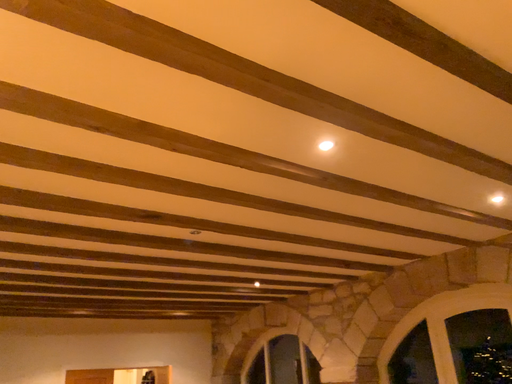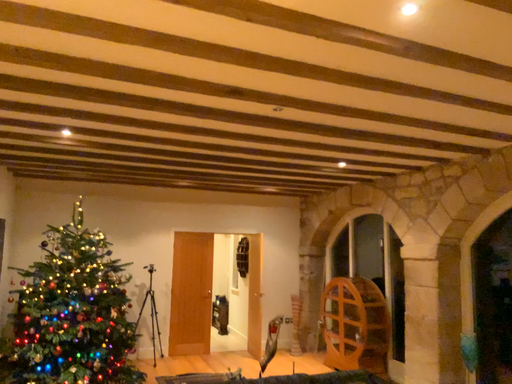
Question: How did the camera likely rotate when shooting the video?

Choices:
 (A) rotated downward
 (B) rotated upward

Answer: (A)